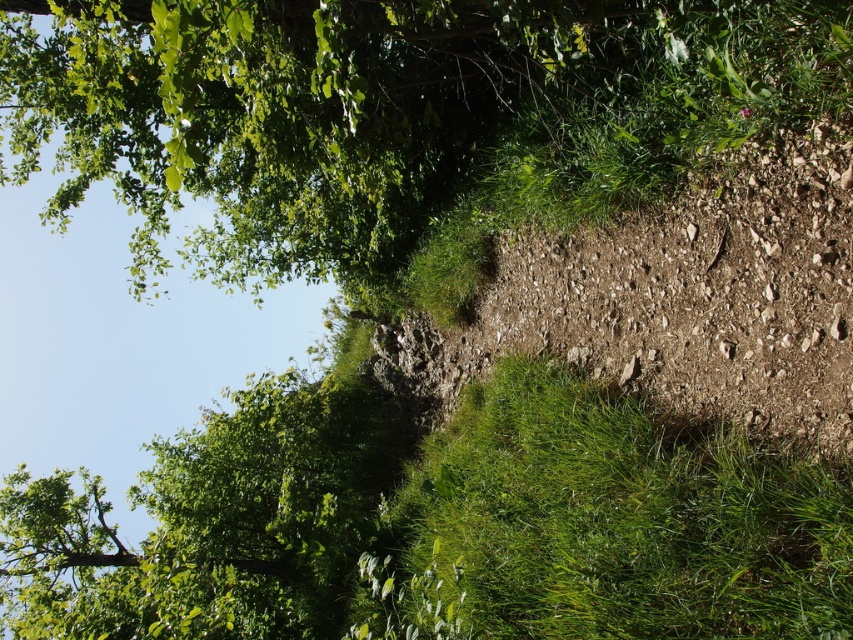
Based on the scene description, where is the green leafy tree at upper left located in terms of its 2D coordinates?

The green leafy tree at upper left is located at the 2D coordinates of point (384, 109).

You are standing on the green grass at lower right and want to walk towards the green leafy tree at upper left. Which direction should you head?

You should head upwards because the green leafy tree at upper left is located above the green grass at lower right.